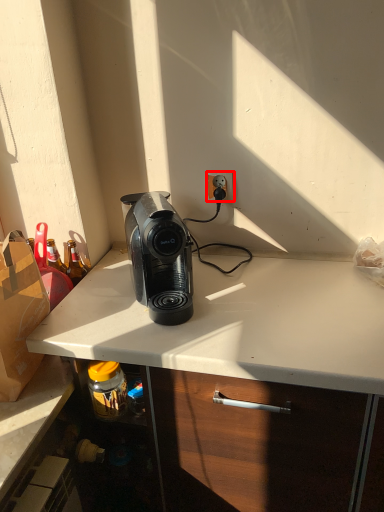
Question: From the image's perspective, considering the relative positions of power outlet (annotated by the red box) and home appliance in the image provided, where is power outlet (annotated by the red box) located with respect to the staircase?

Choices:
 (A) below
 (B) above

Answer: (B)